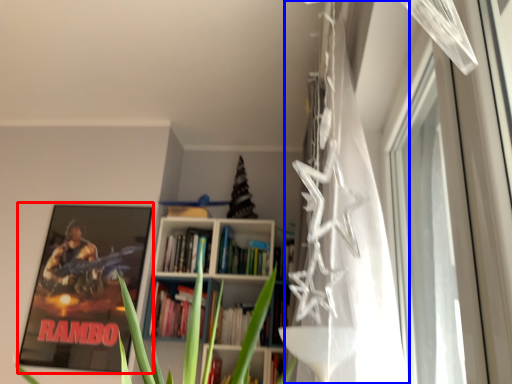
Question: Which of the following is the farthest to the observer, picture frame (highlighted by a red box) or curtain (highlighted by a blue box)?

Choices:
 (A) picture frame
 (B) curtain

Answer: (A)